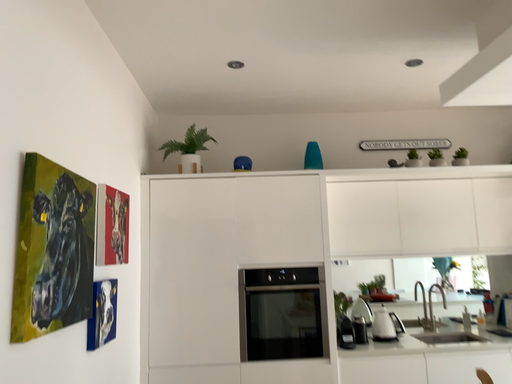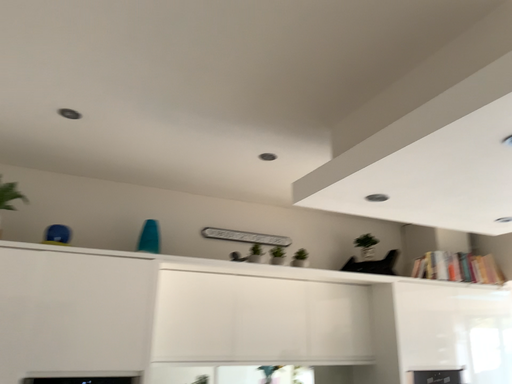
Question: Which way did the camera rotate in the video?

Choices:
 (A) rotated left
 (B) rotated right

Answer: (B)